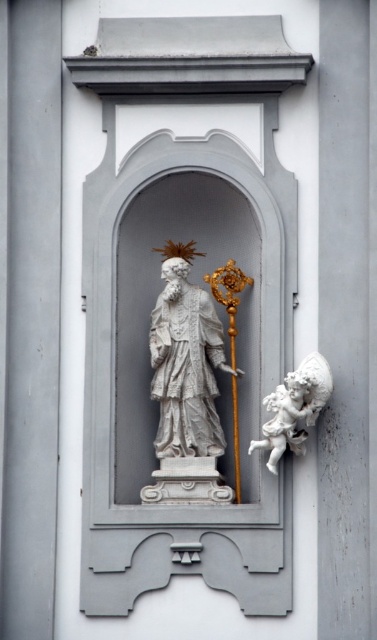
Is white marble statue at center below white marble cherub at lower right?

No.

Can you confirm if white marble statue at center is bigger than white marble cherub at lower right?

Yes.

You are a GUI agent. You are given a task and a screenshot of the screen. Output one action in this format:
    pyautogui.click(x=<x>, y=<y>)
    Task: Click on the white marble statue at center
    
    Given the screenshot: What is the action you would take?
    pyautogui.click(x=185, y=365)

Locate an element on the screen. This screenshot has width=377, height=640. white marble statue at center is located at coordinates (185, 365).